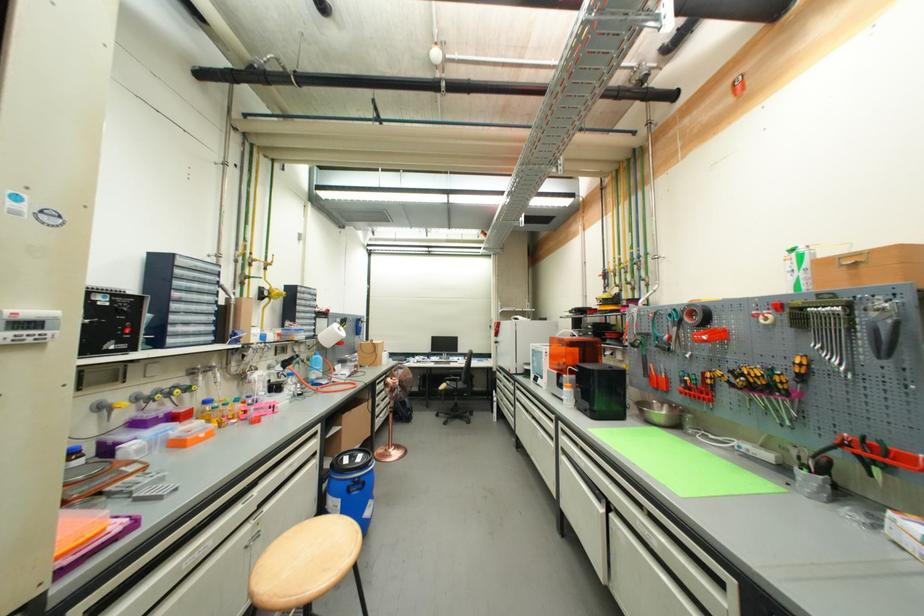
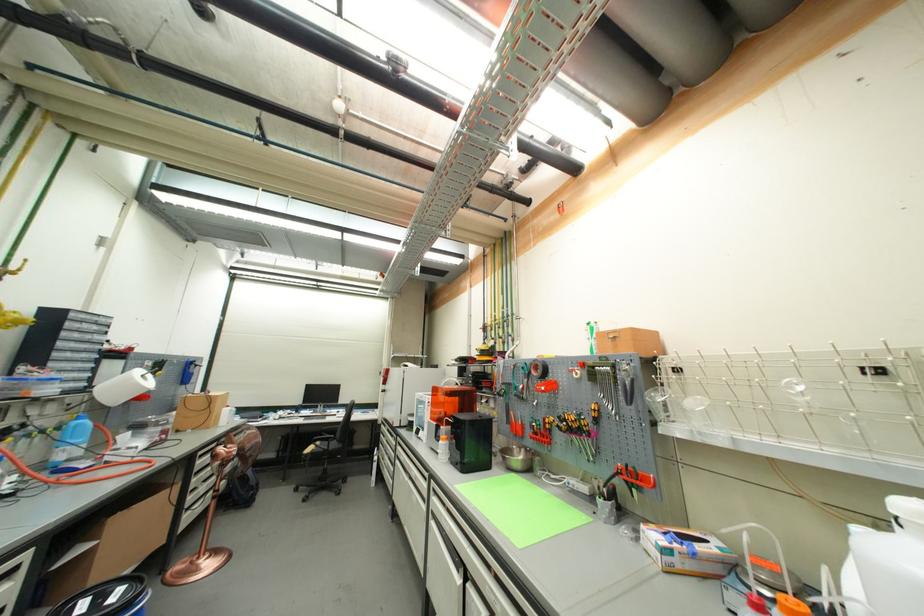
Locate, in the second image, the point that corresponds to [462,415] in the first image.

(330, 485)